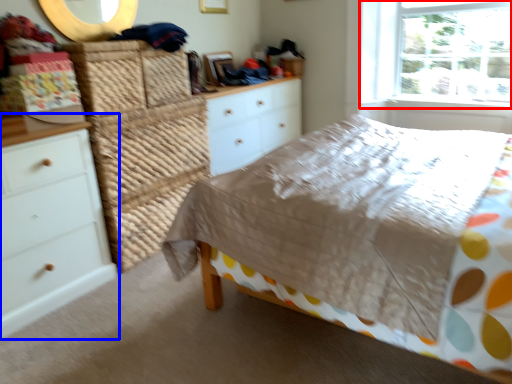
Question: Which point is further to the camera, window (highlighted by a red box) or chest of drawers (highlighted by a blue box)?

Choices:
 (A) window
 (B) chest of drawers

Answer: (A)